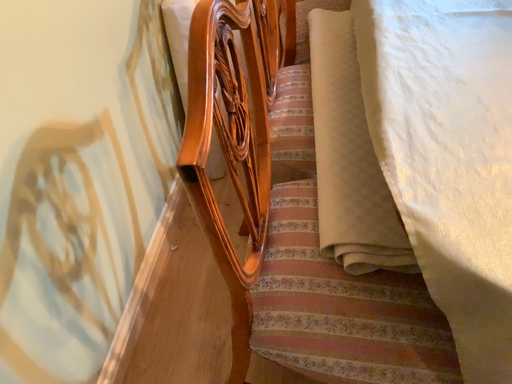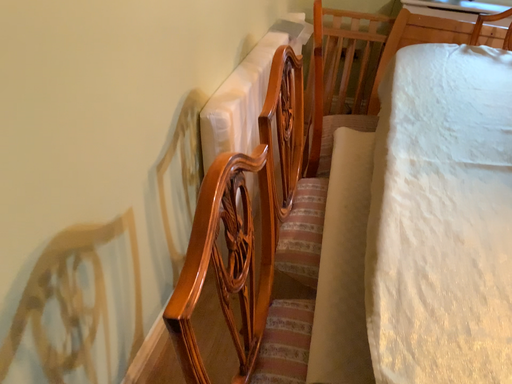
Question: How did the camera likely rotate when shooting the video?

Choices:
 (A) rotated upward
 (B) rotated downward

Answer: (A)